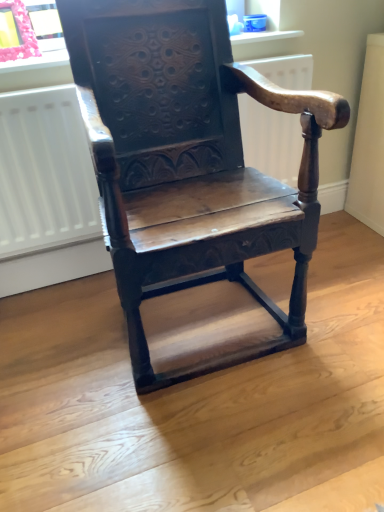
Identify the location of free space between wooden carved chair at center and white matte radiator at center. The height and width of the screenshot is (512, 384). (150, 318).